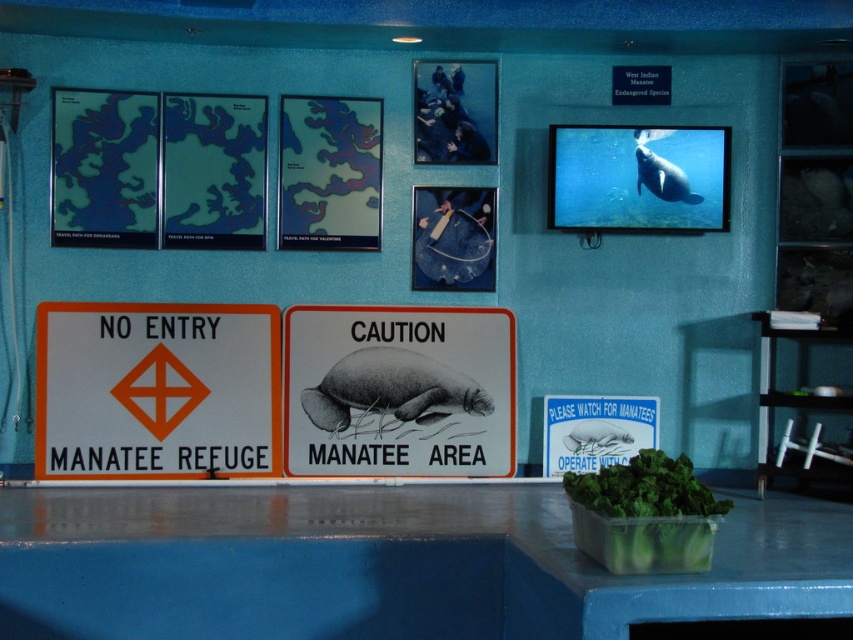
From the picture: Can you confirm if white plastic sign at center is positioned to the left of gray rubber manatee at center?

Correct, you'll find white plastic sign at center to the left of gray rubber manatee at center.

The image size is (853, 640). What are the coordinates of `white plastic sign at center` in the screenshot? It's located at (155, 390).

Where is `white plastic sign at center`? The height and width of the screenshot is (640, 853). white plastic sign at center is located at coordinates (155, 390).

Who is taller, white plastic sign at center or gray/black/white textured manatee at center?

white plastic sign at center is taller.

Can you confirm if white plastic sign at center is thinner than gray/black/white textured manatee at center?

In fact, white plastic sign at center might be wider than gray/black/white textured manatee at center.

Measure the distance between point [128,371] and camera.

Point [128,371] and camera are 16.08 feet apart from each other.

Where is `white plastic sign at center`? The height and width of the screenshot is (640, 853). white plastic sign at center is located at coordinates (155, 390).

Does gray/black/white textured manatee at center have a greater height compared to gray matte manatee at upper center?

Yes, gray/black/white textured manatee at center is taller than gray matte manatee at upper center.

How far apart are gray/black/white textured manatee at center and gray matte manatee at upper center?

gray/black/white textured manatee at center is 5.14 feet away from gray matte manatee at upper center.

Is point (346, 376) behind point (650, 166)?

Yes, point (346, 376) is farther from viewer.

At what (x,y) coordinates should I click in order to perform the action: click on gray/black/white textured manatee at center. Please return your answer as a coordinate pair (x, y). The width and height of the screenshot is (853, 640). Looking at the image, I should click on (392, 388).